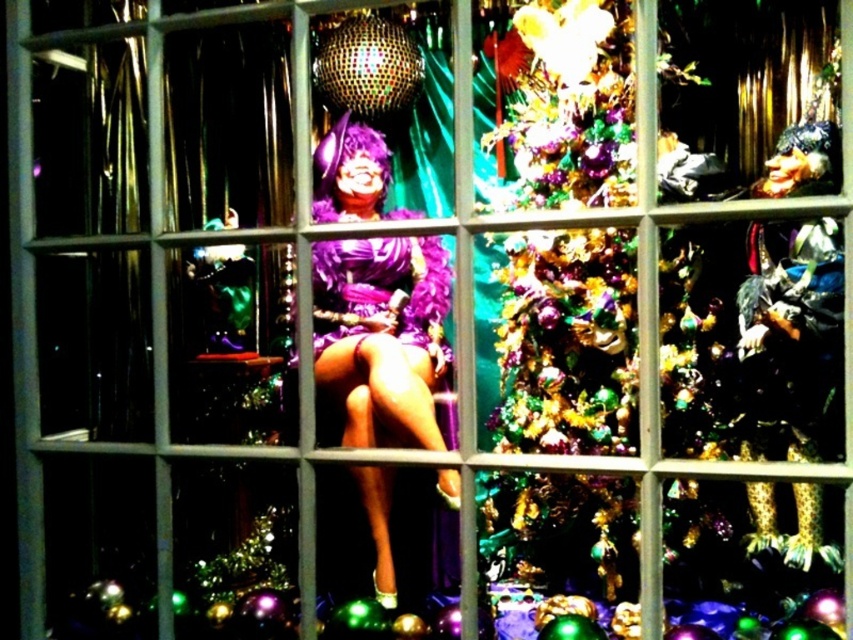
Question: Which point is farther to the camera?

Choices:
 (A) purple feathered dress at center
 (B) shiny gold tinsel at center

Answer: (B)

Question: Which point is closer to the camera?

Choices:
 (A) (419, 304)
 (B) (358, 296)

Answer: (B)

Question: Is purple feathered dress at center above purple satin dress at center?

Choices:
 (A) yes
 (B) no

Answer: (B)

Question: Does purple feathered dress at center appear on the left side of purple satin dress at center?

Choices:
 (A) no
 (B) yes

Answer: (B)

Question: Does purple feathered dress at center have a larger size compared to purple satin dress at center?

Choices:
 (A) no
 (B) yes

Answer: (B)

Question: Estimate the real-world distances between objects in this image. Which object is farther from the purple satin dress at center?

Choices:
 (A) shiny gold tinsel at center
 (B) purple feathered dress at center

Answer: (A)